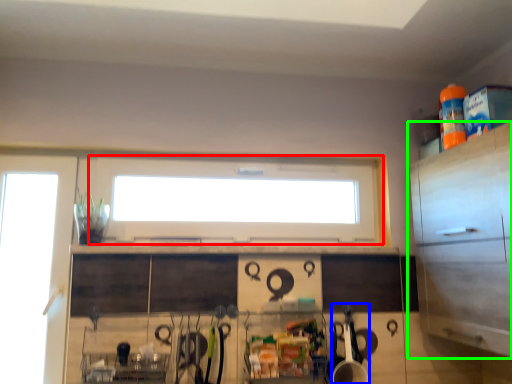
Question: Which is farther away from window (highlighted by a red box)? appliance (highlighted by a blue box) or cabinetry (highlighted by a green box)?

Choices:
 (A) appliance
 (B) cabinetry

Answer: (B)